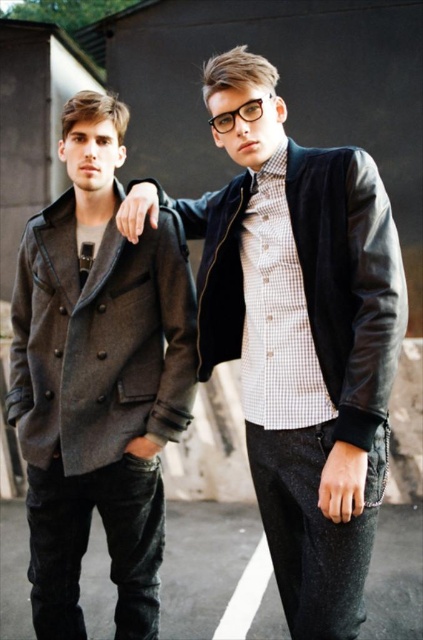
Question: Can you confirm if leather jacket at center is wider than dark gray woolen jacket at left?

Choices:
 (A) no
 (B) yes

Answer: (B)

Question: Can you confirm if leather jacket at center is positioned to the right of dark gray woolen jacket at left?

Choices:
 (A) no
 (B) yes

Answer: (B)

Question: Is leather jacket at center bigger than dark gray woolen jacket at left?

Choices:
 (A) yes
 (B) no

Answer: (A)